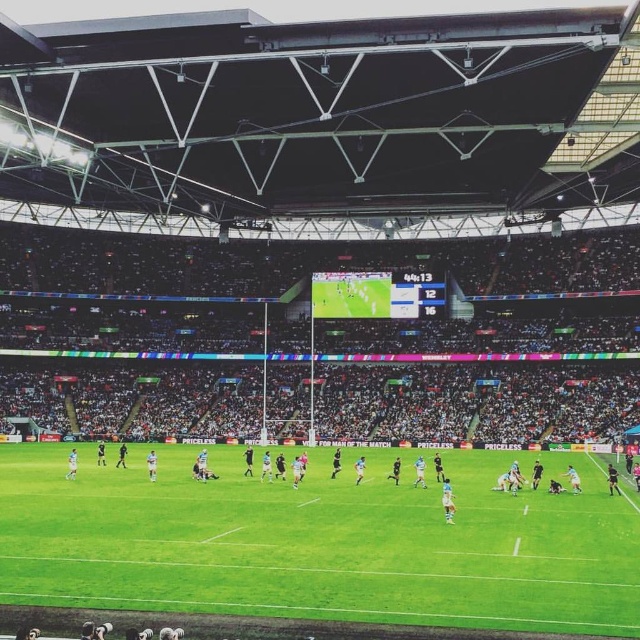
Is point (349, 500) behind point (182, 502)?

That is True.

The height and width of the screenshot is (640, 640). Identify the location of green grass football field at center. (320, 541).

Find the location of a particular element. This screenshot has width=640, height=640. green grass football field at center is located at coordinates (320, 541).